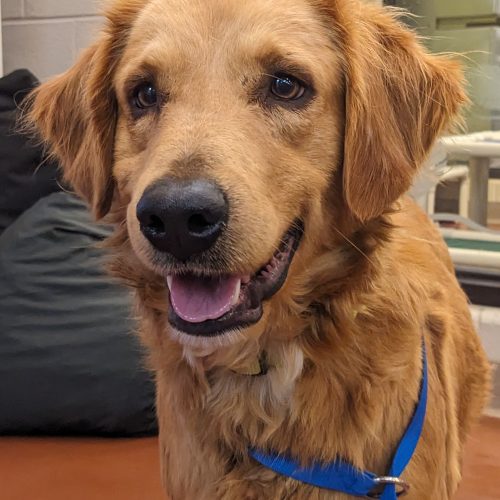
I want to click on cat tree, so click(477, 182), click(480, 143).